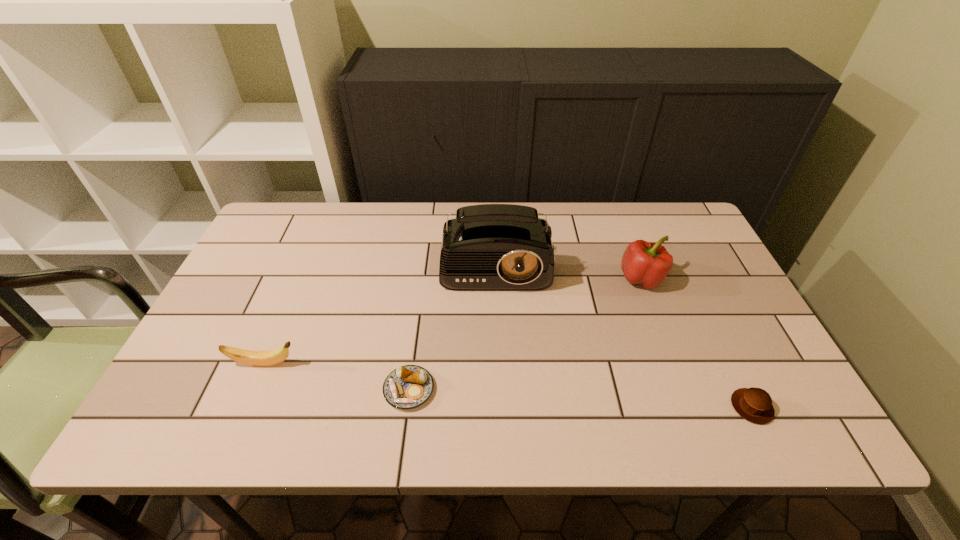
This screenshot has height=540, width=960. What are the coordinates of `vacant space located at the stem of the third nearest object` in the screenshot? It's located at (444, 364).

You are a GUI agent. You are given a task and a screenshot of the screen. Output one action in this format:
    pyautogui.click(x=<x>, y=<y>)
    Task: Click on the vacant space situated on the back of the muffin
    
    Given the screenshot: What is the action you would take?
    pyautogui.click(x=696, y=294)

Where is `vacant space located 0.210m on the left of the shortest object`? vacant space located 0.210m on the left of the shortest object is located at coordinates (288, 389).

Locate an element on the screen. This screenshot has height=540, width=960. object located at the far edge is located at coordinates (490, 247).

This screenshot has width=960, height=540. Find the location of `muffin situated at the near edge`. muffin situated at the near edge is located at coordinates (753, 404).

This screenshot has width=960, height=540. I want to click on pastry that is at the near edge, so click(407, 387).

Locate an element on the screen. Image resolution: width=960 pixels, height=540 pixels. object located in the left edge section of the desktop is located at coordinates (258, 358).

Identify the location of object situated at the right edge. The image size is (960, 540). (753, 404).

You are a GUI agent. You are given a task and a screenshot of the screen. Output one action in this format:
    pyautogui.click(x=<x>, y=<y>)
    Task: Click on the object that is at the near right corner
    This screenshot has height=540, width=960.
    Given the screenshot: What is the action you would take?
    pyautogui.click(x=753, y=404)

The height and width of the screenshot is (540, 960). I want to click on free space at the far edge of the desktop, so click(x=391, y=211).